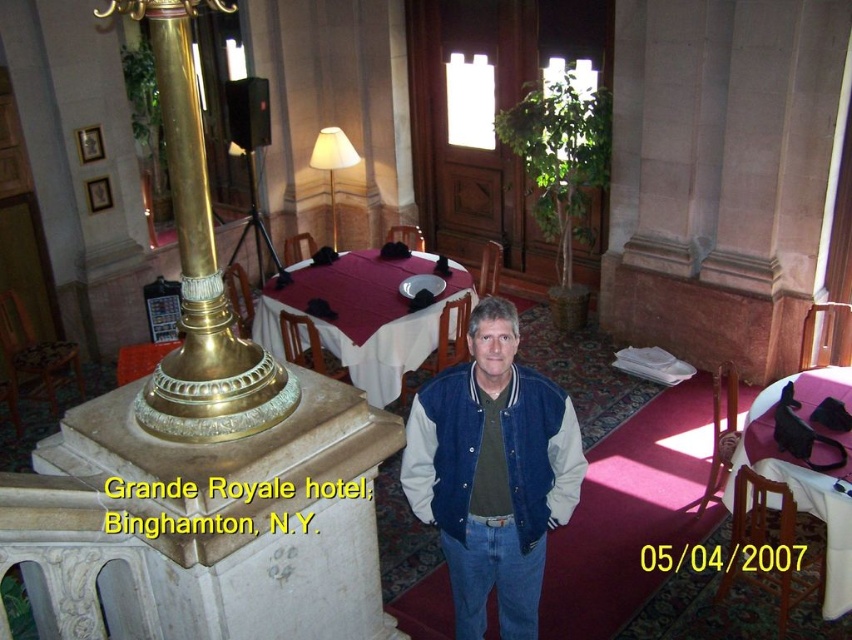
Question: Can you confirm if blue suede jacket at center is positioned to the right of pink fabric table at lower right?

Choices:
 (A) yes
 (B) no

Answer: (B)

Question: Which object is positioned closest to the pink fabric table at lower right?

Choices:
 (A) maroon fabric table at center
 (B) blue suede jacket at center

Answer: (B)

Question: Can you confirm if blue suede jacket at center is smaller than pink fabric table at lower right?

Choices:
 (A) no
 (B) yes

Answer: (B)

Question: Which object is the farthest from the pink fabric table at lower right?

Choices:
 (A) blue suede jacket at center
 (B) maroon fabric table at center

Answer: (B)

Question: Which point is farther to the camera?

Choices:
 (A) (396, 353)
 (B) (815, 509)
 (C) (475, 524)

Answer: (A)

Question: Is blue suede jacket at center to the right of maroon fabric table at center from the viewer's perspective?

Choices:
 (A) yes
 (B) no

Answer: (A)